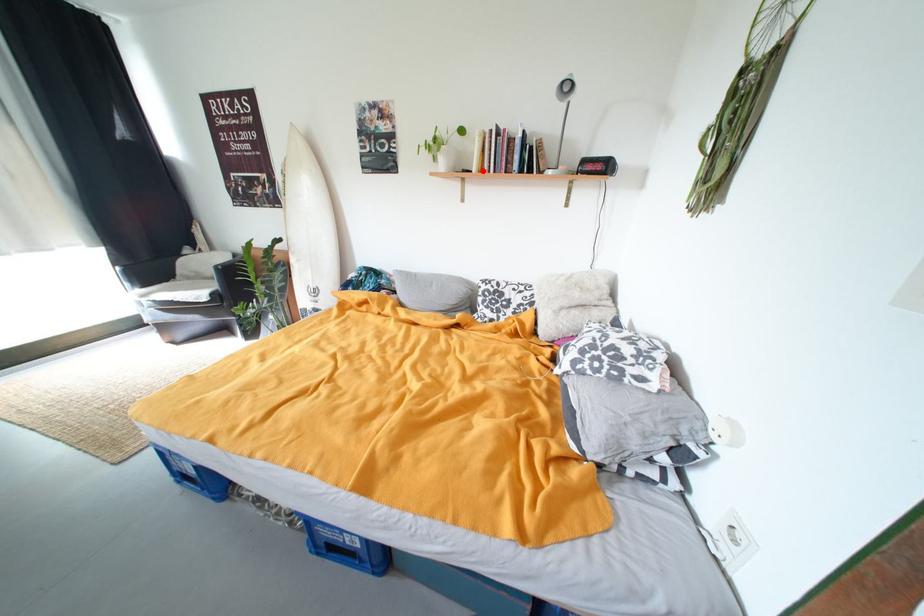
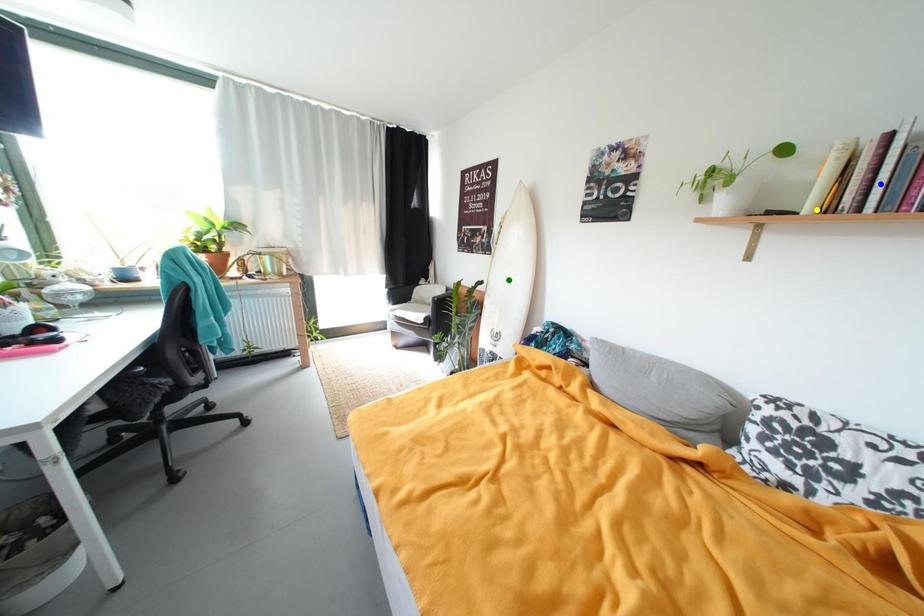
Question: I am providing you with two images of the same scene from different viewpoints. A red point is marked on the first image. You are given multiple points on the second image. Which mark in image 2 goes with the point in image 1?

Choices:
 (A) green point
 (B) blue point
 (C) yellow point

Answer: (C)